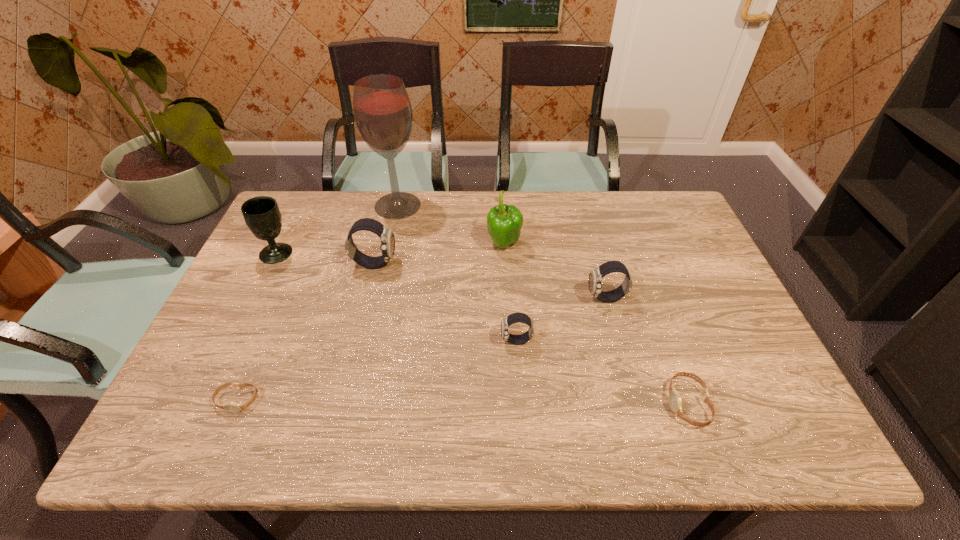
Locate an element on the screen. The width and height of the screenshot is (960, 540). the second shortest object is located at coordinates (675, 402).

Where is `the right beige watch`? The image size is (960, 540). the right beige watch is located at coordinates [x=675, y=402].

The width and height of the screenshot is (960, 540). In order to click on the smaller beige watch in this screenshot , I will do `click(233, 407)`.

Where is `the left beige watch`? This screenshot has width=960, height=540. the left beige watch is located at coordinates (233, 407).

This screenshot has width=960, height=540. Identify the location of vacant area located on the front of the alcohol. (373, 314).

What are the coordinates of `vacant space located 0.350m on the right of the chalice` in the screenshot? It's located at (412, 253).

Locate an element on the screen. This screenshot has width=960, height=540. vacant space located 0.320m on the left of the bell pepper is located at coordinates (380, 245).

Identify the location of vacant space located 0.230m on the face of the fifth shortest object. The width and height of the screenshot is (960, 540). (476, 264).

Find the location of `free point located on the face of the fourth shortest watch`. free point located on the face of the fourth shortest watch is located at coordinates (553, 299).

Where is `free space located on the face of the fourth shortest watch`? free space located on the face of the fourth shortest watch is located at coordinates click(x=535, y=299).